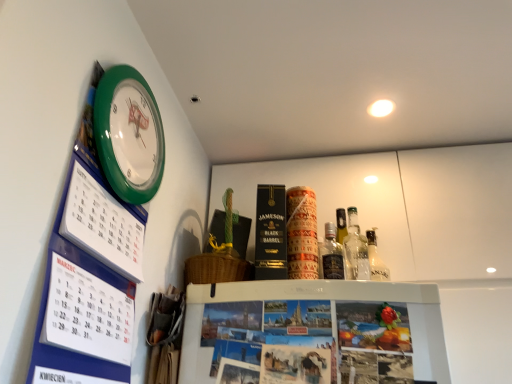
Question: Should I look upward or downward to see green plastic wall clock at upper left?

Choices:
 (A) up
 (B) down

Answer: (A)

Question: Is blue cardboard calendar at upper left bigger than translucent glass bottle at upper right?

Choices:
 (A) no
 (B) yes

Answer: (B)

Question: Is blue cardboard calendar at upper left positioned beyond the bounds of translucent glass bottle at upper right?

Choices:
 (A) no
 (B) yes

Answer: (B)

Question: Considering the relative sizes of blue cardboard calendar at upper left and translucent glass bottle at upper right in the image provided, is blue cardboard calendar at upper left taller than translucent glass bottle at upper right?

Choices:
 (A) no
 (B) yes

Answer: (B)

Question: From a real-world perspective, is blue cardboard calendar at upper left positioned over translucent glass bottle at upper right based on gravity?

Choices:
 (A) no
 (B) yes

Answer: (A)

Question: Considering the relative sizes of blue cardboard calendar at upper left and translucent glass bottle at upper right in the image provided, is blue cardboard calendar at upper left shorter than translucent glass bottle at upper right?

Choices:
 (A) yes
 (B) no

Answer: (B)

Question: From the image's perspective, is blue cardboard calendar at upper left located above translucent glass bottle at upper right?

Choices:
 (A) yes
 (B) no

Answer: (A)

Question: Is translucent glass bottle at upper right taller than green plastic wall clock at upper left?

Choices:
 (A) yes
 (B) no

Answer: (B)

Question: Is green plastic wall clock at upper left surrounded by translucent glass bottle at upper right?

Choices:
 (A) no
 (B) yes

Answer: (A)

Question: Does translucent glass bottle at upper right appear on the left side of green plastic wall clock at upper left?

Choices:
 (A) yes
 (B) no

Answer: (B)

Question: Does translucent glass bottle at upper right lie behind green plastic wall clock at upper left?

Choices:
 (A) yes
 (B) no

Answer: (A)

Question: Does translucent glass bottle at upper right have a larger size compared to green plastic wall clock at upper left?

Choices:
 (A) no
 (B) yes

Answer: (A)

Question: From a real-world perspective, is translucent glass bottle at upper right below green plastic wall clock at upper left?

Choices:
 (A) no
 (B) yes

Answer: (B)

Question: Can we say blue cardboard calendar at upper left lies outside green plastic wall clock at upper left?

Choices:
 (A) yes
 (B) no

Answer: (A)